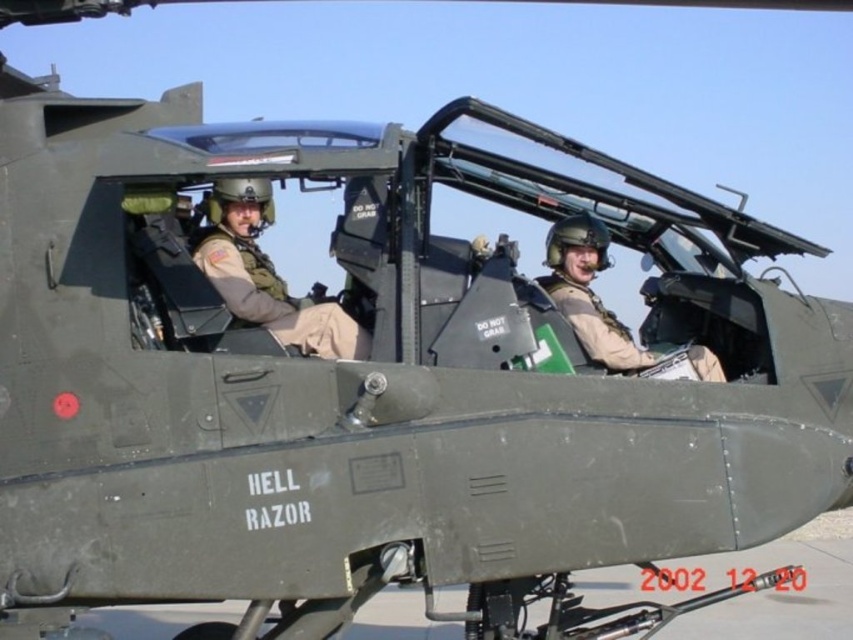
You are a military medic who needs to reach the matte khaki uniform at center to check their vitals. The helicopter is in a hover, and you can only move 10 feet forward. Can you reach them?

The matte khaki uniform at center is 17.26 feet away, so you cannot reach them within the 10 feet movement limit. You need to find another way to approach.

You are a military inspector checking the cockpit of the helicopter. You need to ensure that the matte khaki uniform at center and the matte green helmet at center meet the size requirements. Which object is wider?

The matte khaki uniform at center is narrower than the matte green helmet at center, so the helmet is wider.